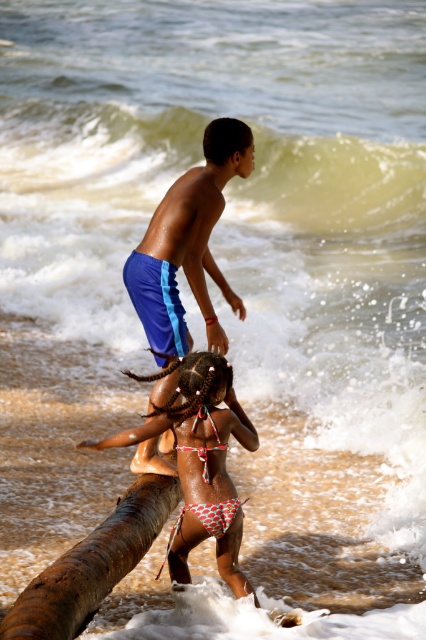
You are a photographer trying to capture both the polka dot bikini at center and the brown rough tree trunk at lower left in a single frame. Given their sizes, which object will appear bigger in the photo?

The polka dot bikini at center will appear bigger in the photo because it has a larger size compared to the brown rough tree trunk at lower left according to the description.

You are standing at the beach and see the blue fabric shorts at upper center. If you want to reach them quickly, how many steps would you estimate you need to take, assuming each step covers about 0.75 meters?

The distance between you and the blue fabric shorts at upper center is 5.87 meters. Dividing this by the step length of 0.75 meters gives approximately 7.83 steps. Since you can only take whole steps, you would need around 8 steps to reach the blue fabric shorts at upper center.

You are a photographer trying to capture both the blue fabric shorts at upper center and the brown rough tree trunk at lower left in the same frame. Which object should you focus on first to ensure both are in the frame?

You should focus on the brown rough tree trunk at lower left first because it is closer to you than the blue fabric shorts at upper center, so adjusting the camera to include the closer object ensures the farther one will also be in view.